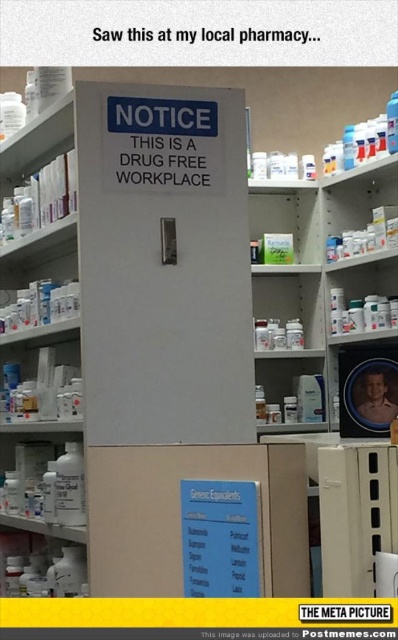
You are a pharmacist organizing items in the pharmacy. You need to place both the green matte box at center and the white plastic bottle at lower left on a shelf. Based on their sizes, which item should you place first to maximize shelf space efficiency?

The green matte box at center occupies less space than the white plastic bottle at lower left, so you should place the white plastic bottle at lower left first to utilize the available space more efficiently.

Looking at this image, you are a delivery person who just arrived at the pharmacy. You need to place a new delivery of medications into the correct storage location. The delivery requires placing items into a specific box. Where exactly is the green matte box at center located in the pharmacy scene?

The green matte box at center is located at point (288, 216) in the pharmacy scene.